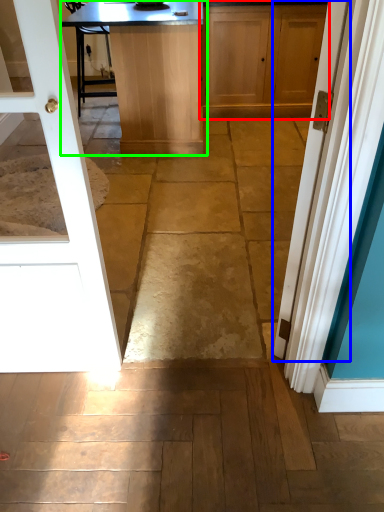
Question: Estimate the real-world distances between objects in this image. Which object is closer to cabinetry (highlighted by a red box), door (highlighted by a blue box) or table (highlighted by a green box)?

Choices:
 (A) door
 (B) table

Answer: (B)